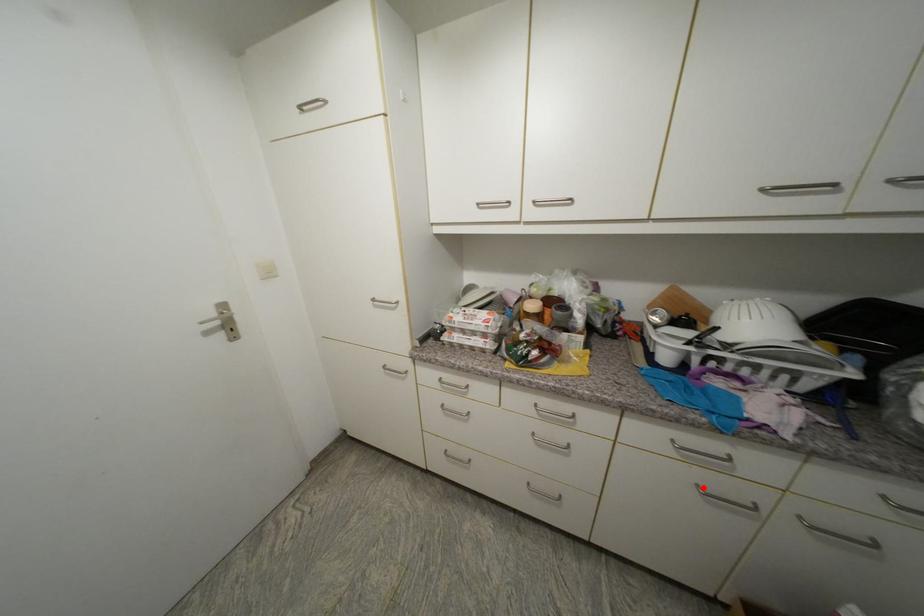
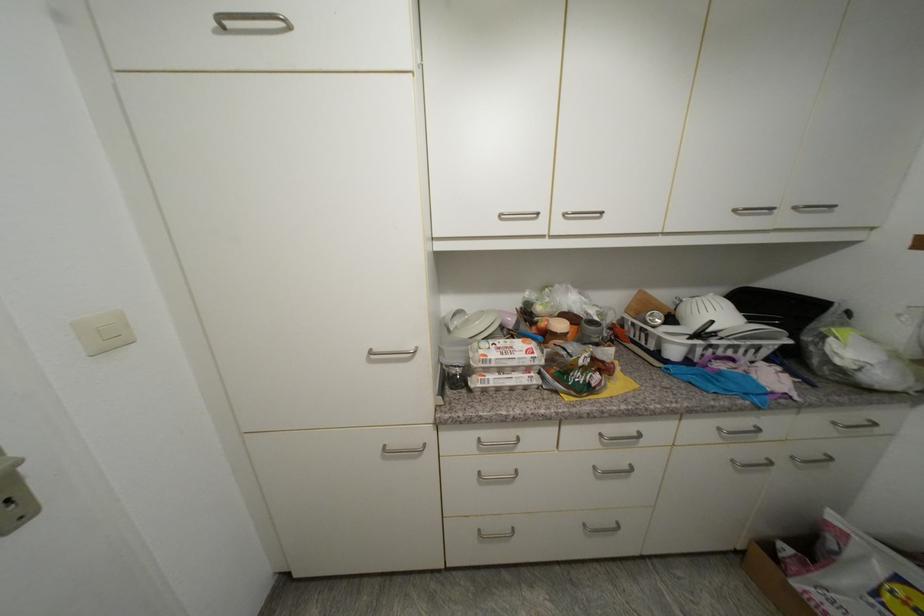
The point at the highlighted location is marked in the first image. Where is the corresponding point in the second image?

(738, 463)